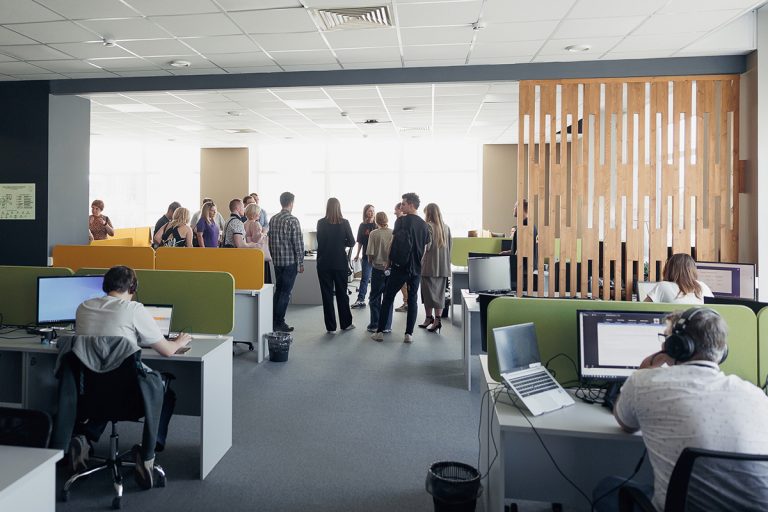
Locate an element on the screen. cords is located at coordinates (478, 425), (485, 442), (492, 447), (544, 448), (637, 471), (555, 351), (591, 393).